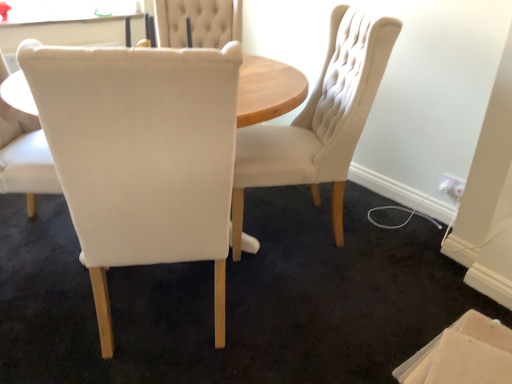
Locate an element on the screen. free spot to the right of matte white chair at center, acting as the second chair starting from the left is located at coordinates (304, 313).